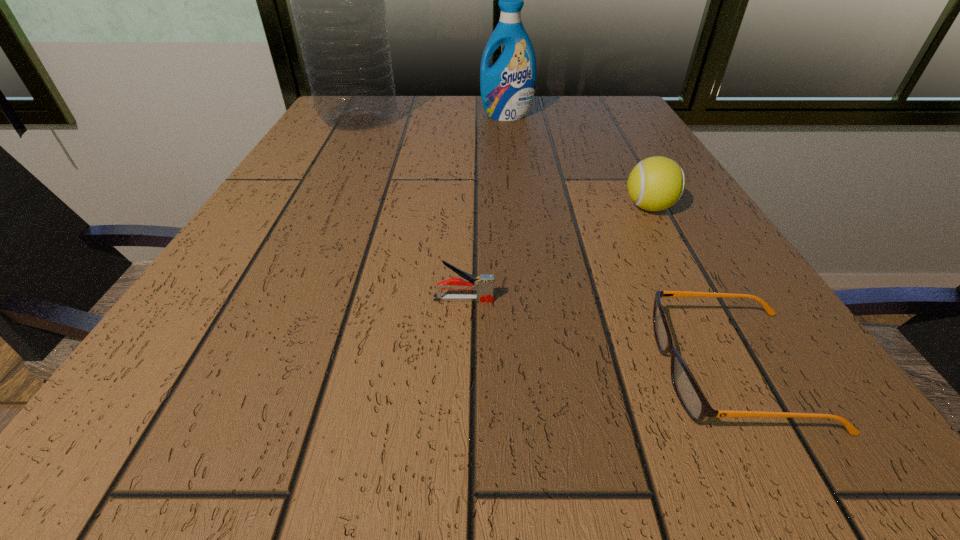
This screenshot has height=540, width=960. I want to click on free space between the water jug and the third nearest object, so click(504, 163).

The image size is (960, 540). I want to click on unoccupied area between the third nearest object and the shortest object, so click(692, 288).

I want to click on free spot between the tallest object and the shortest object, so click(547, 244).

At what (x,y) coordinates should I click in order to perform the action: click on free space between the tennis ball and the second tallest object. Please return your answer as a coordinate pair (x, y). Image resolution: width=960 pixels, height=540 pixels. Looking at the image, I should click on (578, 161).

Locate an element on the screen. free space between the second shortest object and the detergent is located at coordinates (485, 207).

The image size is (960, 540). Identify the location of vacant space that's between the shortest object and the fourth shortest object. (621, 242).

The image size is (960, 540). In order to click on free spot between the third tallest object and the fourth farthest object in this screenshot , I will do `click(556, 253)`.

You are a GUI agent. You are given a task and a screenshot of the screen. Output one action in this format:
    pyautogui.click(x=<x>, y=<y>)
    Task: Click on the vacant area between the fourth farthest object and the tennis ball
    The image size is (960, 540).
    Given the screenshot: What is the action you would take?
    pyautogui.click(x=556, y=253)

Locate an element on the screen. object identified as the third closest to the leftmost object is located at coordinates (484, 284).

Locate which object ranks third in proximity to the tallest object. Please provide its 2D coordinates. Your answer should be formatted as a tuple, i.e. [(x, y)], where the tuple contains the x and y coordinates of a point satisfying the conditions above.

[(484, 284)]